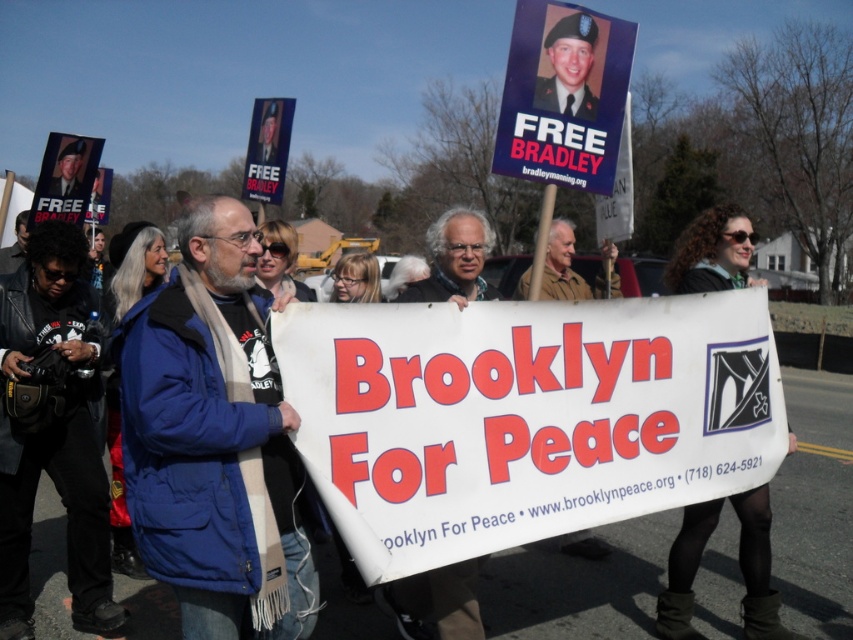
Question: Which of the following is the closest to the observer?

Choices:
 (A) blue fabric jacket at center
 (B) black leather jacket at lower left

Answer: (A)

Question: Which of the following is the closest to the observer?

Choices:
 (A) blue fabric jacket at center
 (B) black leather jacket at lower left

Answer: (A)

Question: Is blue fabric jacket at center behind black leather jacket at lower left?

Choices:
 (A) no
 (B) yes

Answer: (A)

Question: Is blue fabric jacket at center behind black leather jacket at lower left?

Choices:
 (A) no
 (B) yes

Answer: (A)

Question: Is blue fabric jacket at center above black leather jacket at lower left?

Choices:
 (A) no
 (B) yes

Answer: (B)